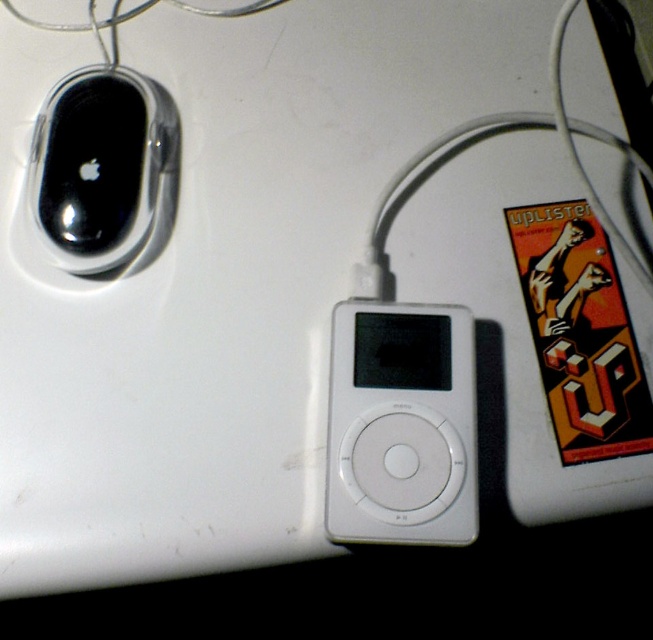
You are a delivery person who just arrived at a customer service desk. The desk has a white laptop with several items on it. The customer is pointing to an object on the laptop and says, I want to return this item. The customer is pointing at the location marked by point (402,424). Which item are they pointing at?

The point (402,424) marks the white matte iPod at center, so the customer is pointing at the white matte iPod at center.